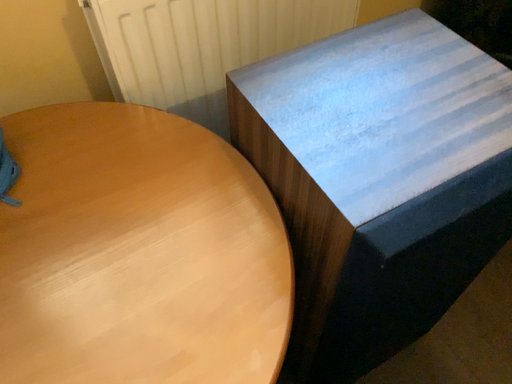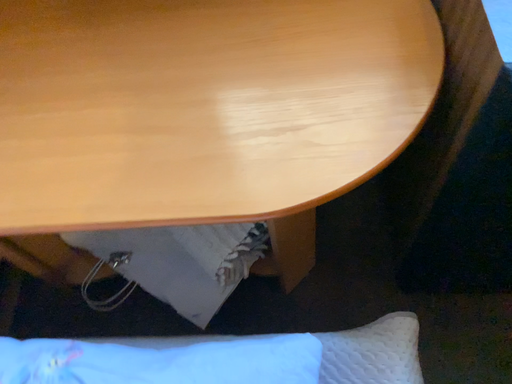
Question: Which way did the camera rotate in the video?

Choices:
 (A) rotated right
 (B) rotated left

Answer: (B)